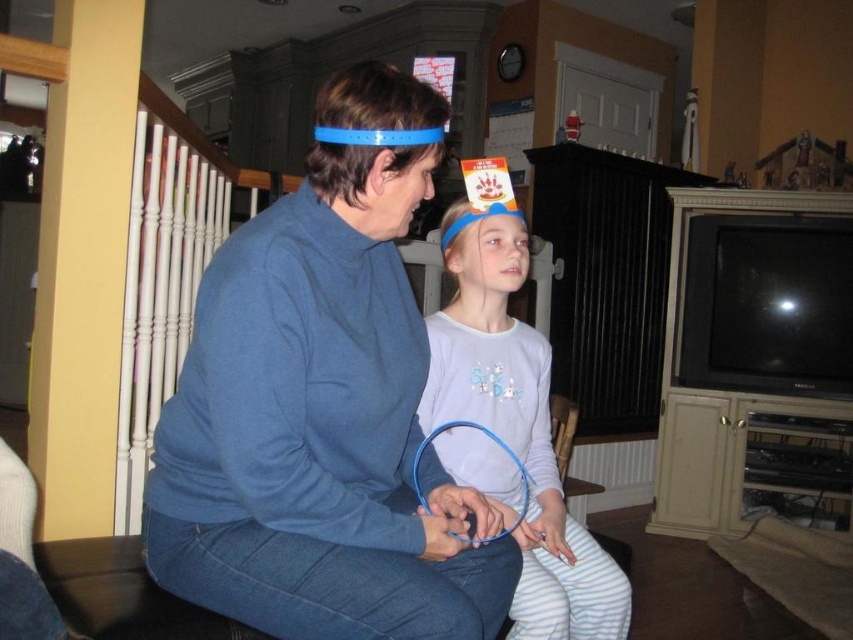
You are helping organize a clothing donation drive and need to arrange items by color. You have a matte blue sweater at center and a white cotton shirt at center. Which item should you place on the left side of the display to maintain color order from left to right as blue followed by white?

The matte blue sweater at center should be placed on the left side of the display since it is already positioned to the left of the white cotton shirt at center in the image, aligning with the desired blue followed by white color order.

You are a tailor measuring clothes for a customer. You notice two garments in the image, the matte blue sweater at center and the white cotton shirt at center. Which garment should you consider for a customer who needs a wider garment?

The matte blue sweater at center might be wider than the white cotton shirt at center, so it should be considered for the customer needing a wider garment.